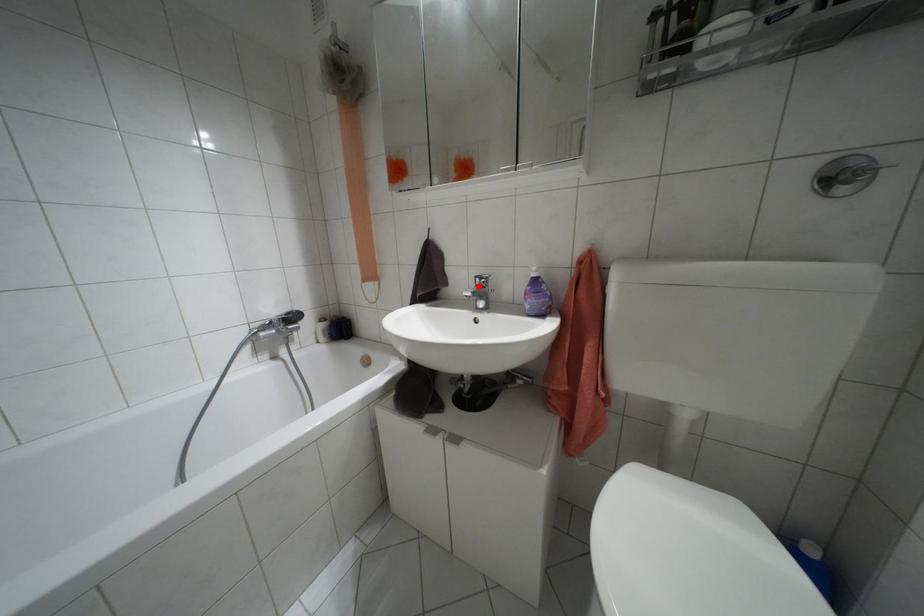
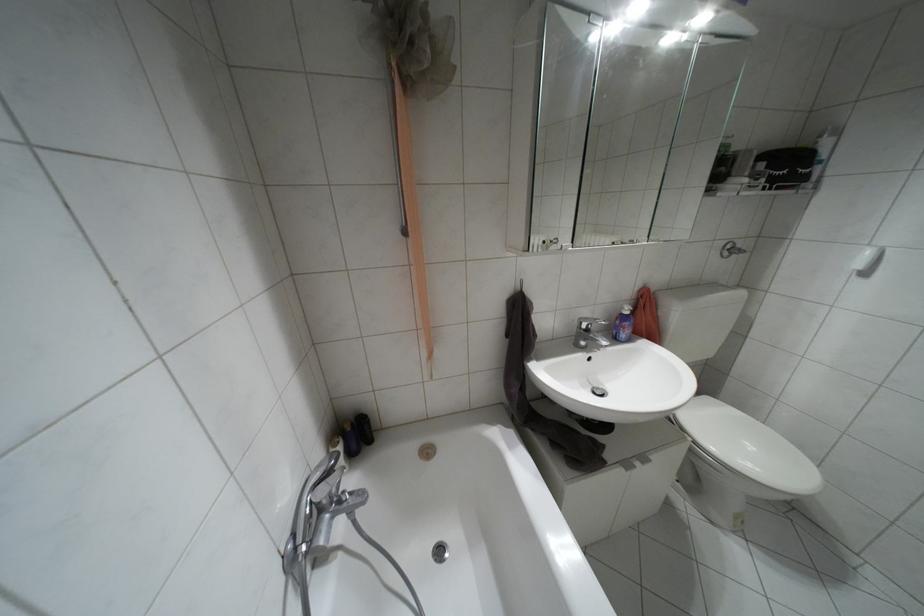
Locate, in the second image, the point that corresponds to the highlighted location in the first image.

(587, 330)